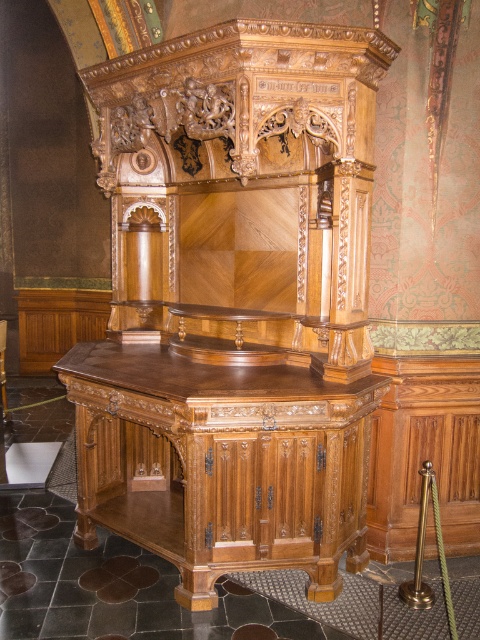
Between polished wood table at center and wooden carved chair at center, which one has more height?

With more height is polished wood table at center.

Between polished wood table at center and wooden carved chair at center, which one is positioned lower?

polished wood table at center is lower down.

This screenshot has height=640, width=480. Find the location of `polished wood table at center`. polished wood table at center is located at coordinates (220, 464).